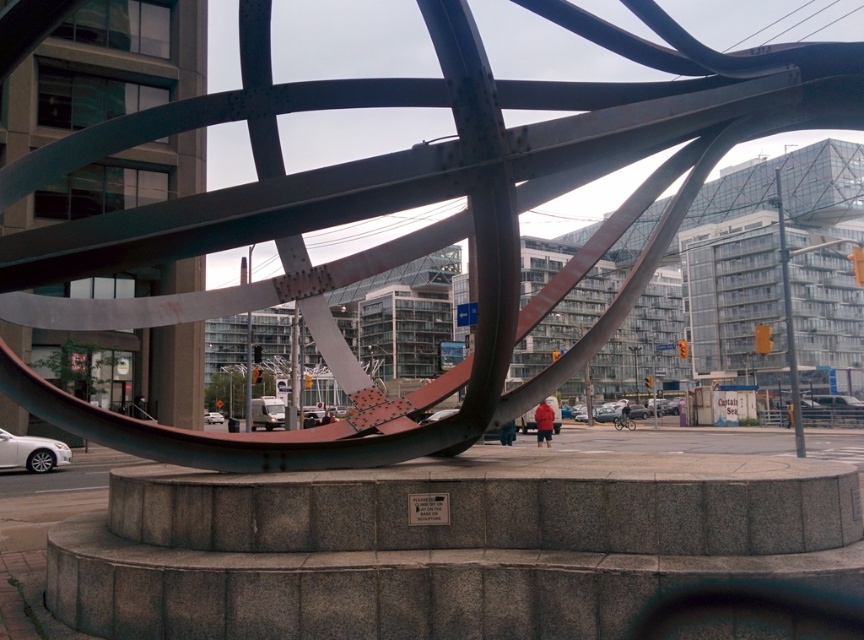
Measure the distance between red matte jacket at center and camera.

A distance of 5.39 meters exists between red matte jacket at center and camera.

Is red matte jacket at center shorter than denim jacket at center?

No.

Identify the location of red matte jacket at center. The height and width of the screenshot is (640, 864). (543, 422).

The width and height of the screenshot is (864, 640). Find the location of `polished steel sculpture at center`. polished steel sculpture at center is located at coordinates (442, 198).

Looking at this image, who is taller, polished steel sculpture at center or red matte jacket at center?

With more height is red matte jacket at center.

Where is `polished steel sculpture at center`? Image resolution: width=864 pixels, height=640 pixels. polished steel sculpture at center is located at coordinates (442, 198).

Is polished steel sculpture at center behind denim jacket at center?

Yes.

From the picture: Does polished steel sculpture at center have a smaller size compared to denim jacket at center?

Yes.

Is point (408, 253) less distant than point (507, 433)?

Yes, point (408, 253) is closer to viewer.

The height and width of the screenshot is (640, 864). Identify the location of polished steel sculpture at center. (442, 198).